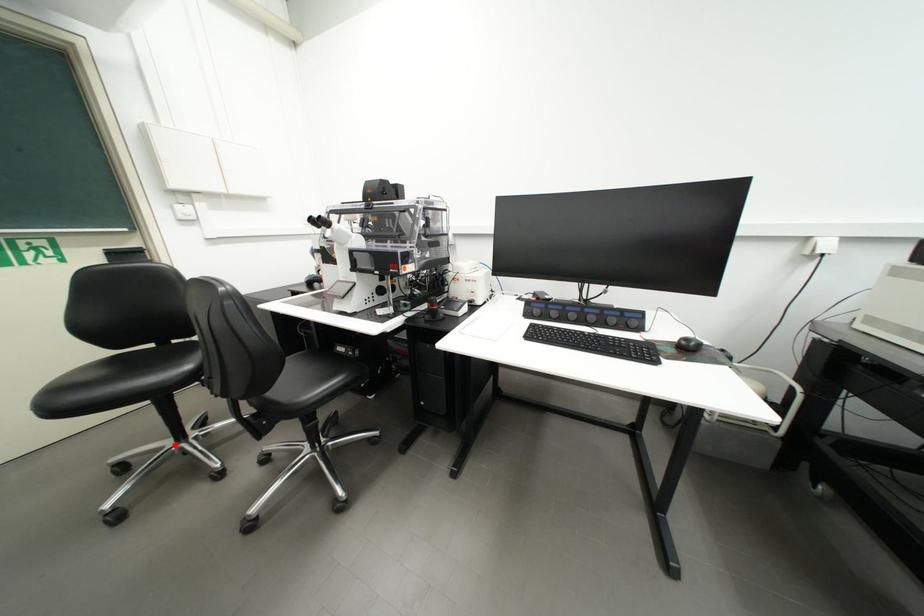
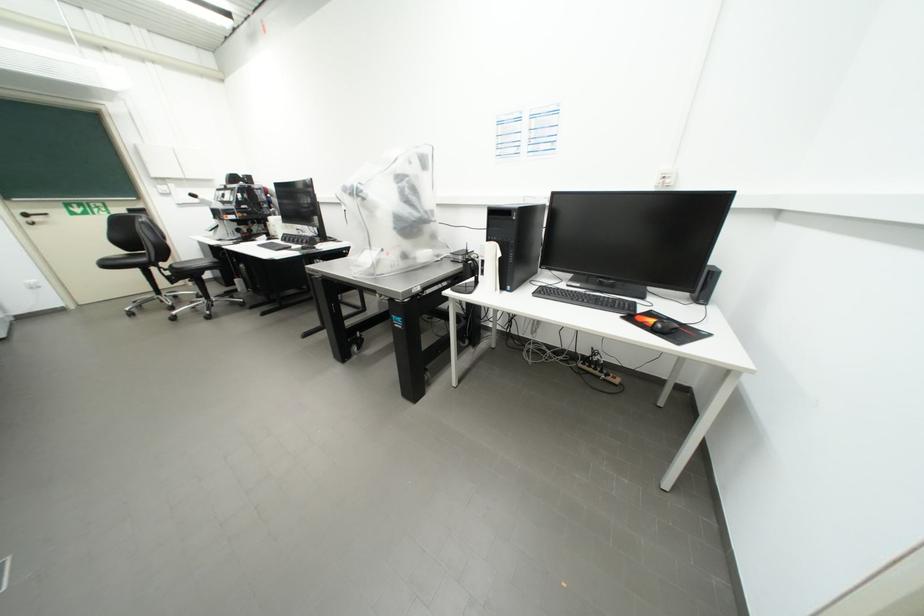
The point at the highlighted location is marked in the first image. Where is the corresponding point in the second image?

(160, 296)